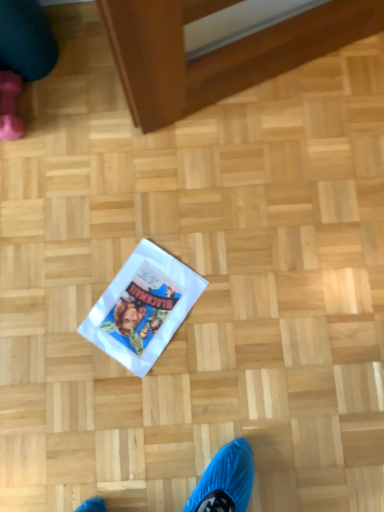
Find the location of a particular element. Image resolution: width=384 pixels, height=512 pixels. vacant area that lies to the right of white paper flyer at center is located at coordinates (237, 297).